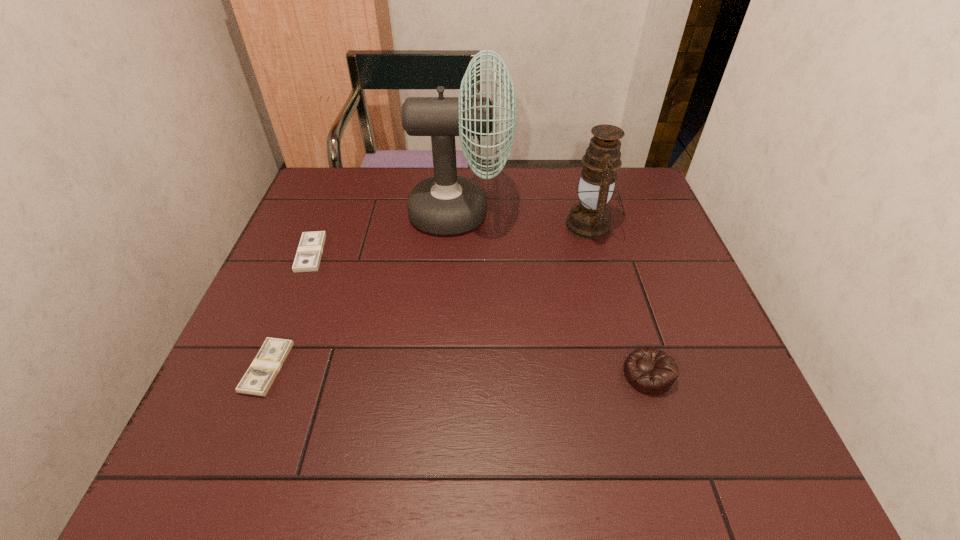
Identify the location of fan. This screenshot has height=540, width=960. [446, 204].

Locate an element on the screen. The height and width of the screenshot is (540, 960). the tallest object is located at coordinates (446, 204).

The height and width of the screenshot is (540, 960). Find the location of `the fourth shortest object`. the fourth shortest object is located at coordinates (590, 219).

Identify the location of the third shortest object. (651, 371).

Find the location of `the farther dollar`. the farther dollar is located at coordinates (308, 256).

The image size is (960, 540). Identify the location of the nearer dollar. (259, 377).

Where is `free space located 0.210m in front of the tallest object where the airflow is directed`? The height and width of the screenshot is (540, 960). free space located 0.210m in front of the tallest object where the airflow is directed is located at coordinates (583, 213).

Find the location of a particular element. This screenshot has width=960, height=540. vacant area situated on the front of the oil lamp is located at coordinates (606, 280).

You are a GUI agent. You are given a task and a screenshot of the screen. Output one action in this format:
    pyautogui.click(x=<x>, y=<y>)
    Task: Click on the vacant region located 0.150m on the left of the third shortest object
    
    Given the screenshot: What is the action you would take?
    pyautogui.click(x=550, y=374)

Where is `free space located on the back of the farther dollar`? The image size is (960, 540). free space located on the back of the farther dollar is located at coordinates (337, 190).